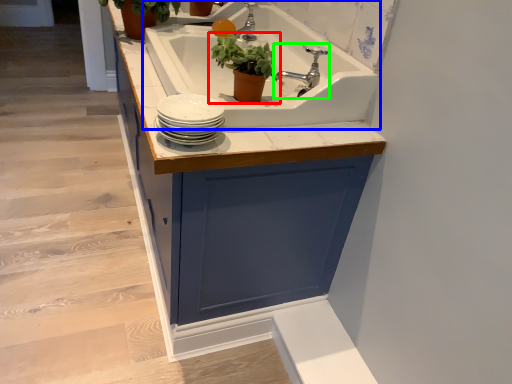
Question: Estimate the real-world distances between objects in this image. Which object is closer to houseplant (highlighted by a red box), sink (highlighted by a blue box) or tap (highlighted by a green box)?

Choices:
 (A) sink
 (B) tap

Answer: (B)